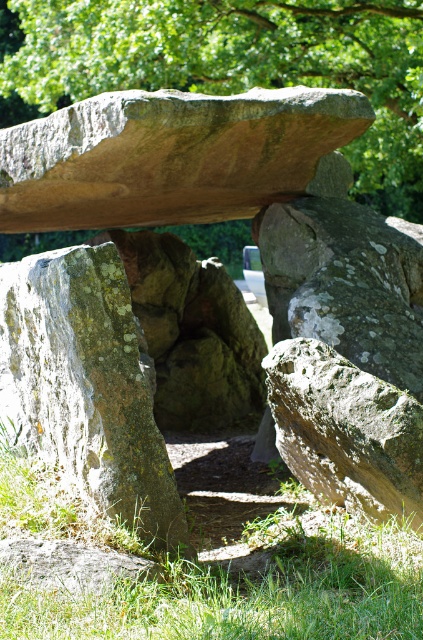
Question: Among these points, which one is nearest to the camera?

Choices:
 (A) (5, 436)
 (B) (342, 36)

Answer: (A)

Question: Estimate the real-world distances between objects in this image. Which object is farther from the green leafy tree at upper center?

Choices:
 (A) green grass at lower center
 (B) lichen-covered rock at left

Answer: (A)

Question: Considering the real-world distances, which object is closest to the green grass at lower center?

Choices:
 (A) green leafy tree at upper center
 (B) lichen-covered rock at left

Answer: (B)

Question: Is green grass at lower center in front of green leafy tree at upper center?

Choices:
 (A) yes
 (B) no

Answer: (A)

Question: In this image, where is green grass at lower center located relative to lichen-covered rock at left?

Choices:
 (A) left
 (B) right

Answer: (B)

Question: In this image, where is green grass at lower center located relative to lichen-covered rock at left?

Choices:
 (A) below
 (B) above

Answer: (A)